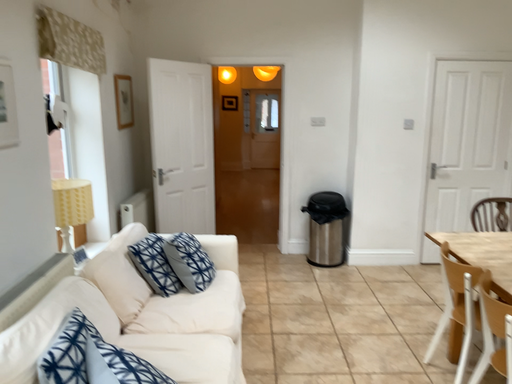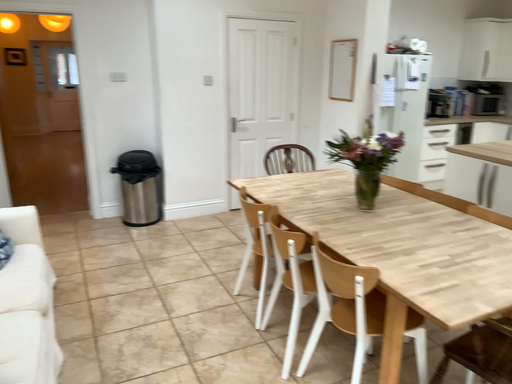
Question: Which way did the camera rotate in the video?

Choices:
 (A) rotated left
 (B) rotated right

Answer: (B)